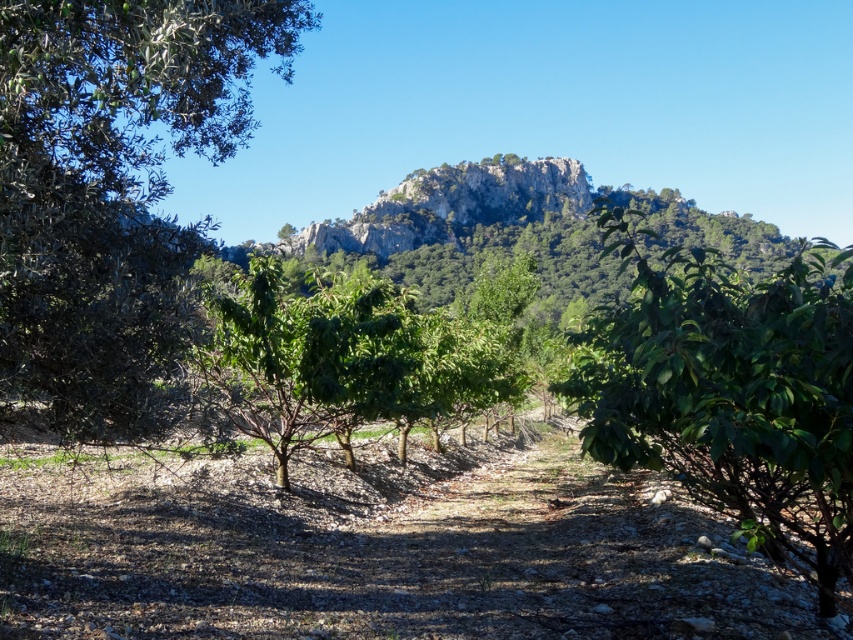
You are standing on the dirt path in the orchard and see the green glossy tree at center and the rocky gray mountain at center. Which object is nearer to you?

The green glossy tree at center is closer to the viewer than the rocky gray mountain at center, so the green glossy tree at center is nearer to you.

From the picture: You are standing at the point marked by coordinates point (112, 188) in the orchard. Which direction should you walk to reach the green leafy tree at left?

The point (112, 188) is the location of the green leafy tree at left, so you are already at the tree.

You are standing at the center of the dirt path in the orchard. If you look towards the green leafy tree at left, in which direction relative to the path are you facing?

The green leafy tree at left is located at 2D coordinates point (x=112, y=188), which places it to the left side of the dirt path. Therefore, you would be facing towards the left direction relative to the path.